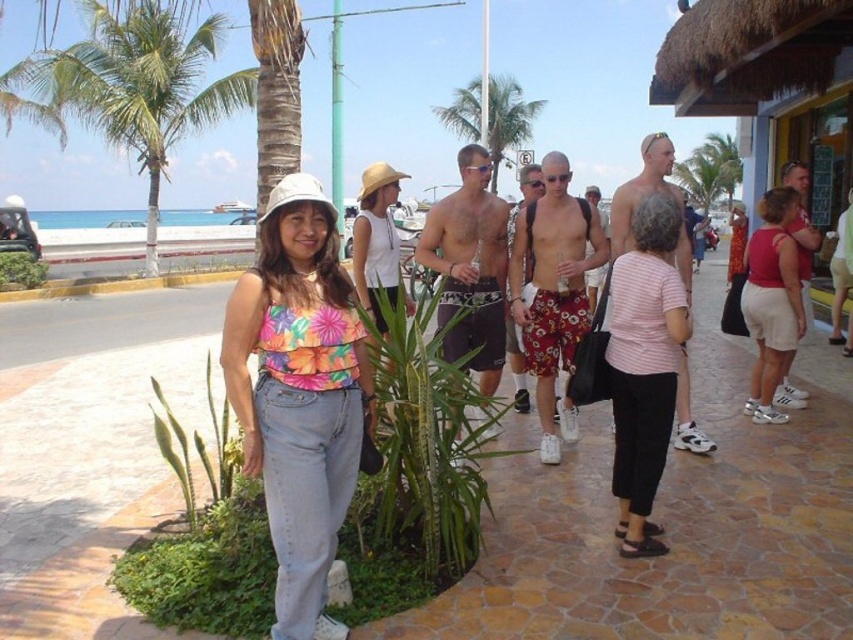
Question: In this image, where is pink striped shirt at center located relative to shiny silver watch at center?

Choices:
 (A) above
 (B) below

Answer: (B)

Question: Which of the following is the closest to the observer?

Choices:
 (A) matte red tank top at right
 (B) pink striped shirt at center

Answer: (B)

Question: Does floral fabric top at center have a lesser width compared to matte pink tank top at center?

Choices:
 (A) yes
 (B) no

Answer: (B)

Question: Which object is closer to the camera taking this photo?

Choices:
 (A) smooth stone pavement at center
 (B) dark gray swim trunks at center
 (C) green leafy palm tree at upper left

Answer: (A)

Question: Which object is the farthest from the smooth stone pavement at center?

Choices:
 (A) green leafy palm tree at center
 (B) green leafy palm tree at upper center

Answer: (B)

Question: Does floral print shorts at center appear under green leafy plant at lower left?

Choices:
 (A) yes
 (B) no

Answer: (A)